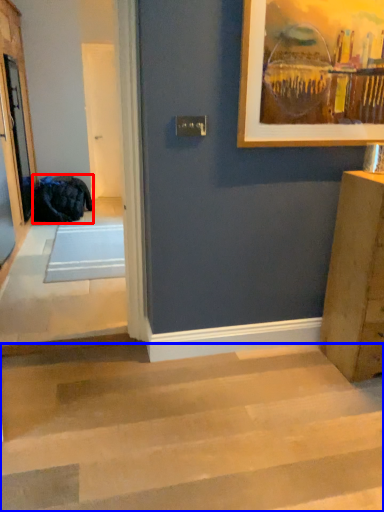
Question: Which object is closer to the camera taking this photo, laundry (highlighted by a red box) or stairwell (highlighted by a blue box)?

Choices:
 (A) laundry
 (B) stairwell

Answer: (B)